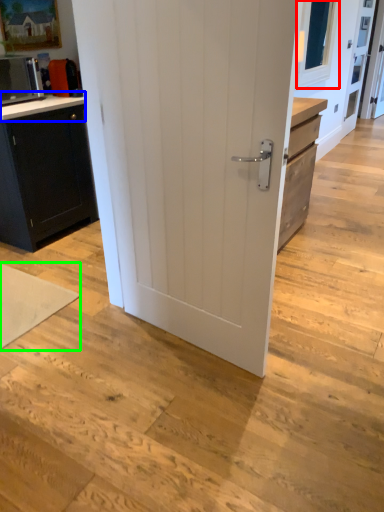
Question: Which object is the closest to the window screen (highlighted by a red box)? Choose among these: counter top (highlighted by a blue box) or yoga mat (highlighted by a green box).

Choices:
 (A) counter top
 (B) yoga mat

Answer: (A)